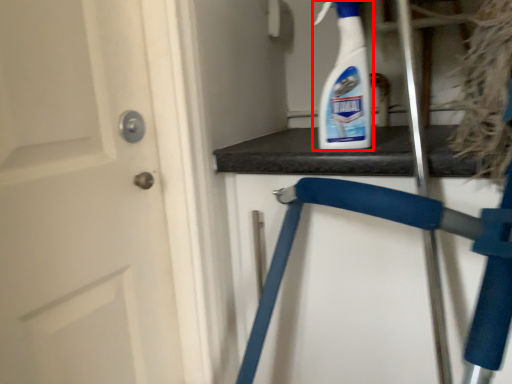
Question: From the image's perspective, considering the relative positions of cleaning product (annotated by the red box) and folding chair in the image provided, where is cleaning product (annotated by the red box) located with respect to the staircase?

Choices:
 (A) below
 (B) above

Answer: (B)